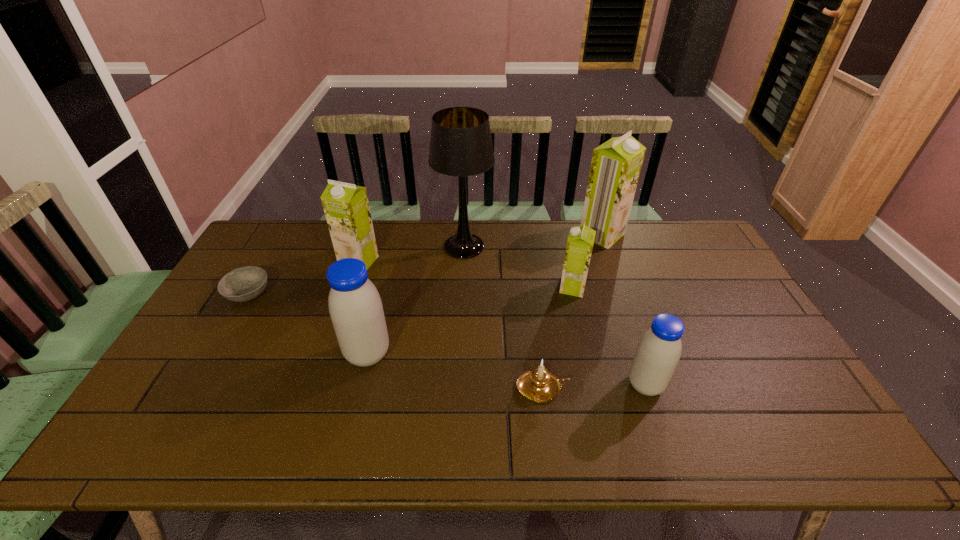
This screenshot has width=960, height=540. I want to click on free space between the leftmost object and the third object from right to left, so click(x=411, y=291).

The height and width of the screenshot is (540, 960). I want to click on free space between the bowl and the left blue soya milk, so pos(308,324).

Where is `vacant space in between the fifth object from left to right and the bigger blue soya milk`? This screenshot has height=540, width=960. vacant space in between the fifth object from left to right and the bigger blue soya milk is located at coordinates (455, 371).

You are a GUI agent. You are given a task and a screenshot of the screen. Output one action in this format:
    pyautogui.click(x=<x>, y=<y>)
    Task: Click on the free area in between the fourth object from right to left and the bigger blue soya milk
    The height and width of the screenshot is (540, 960).
    Given the screenshot: What is the action you would take?
    pyautogui.click(x=455, y=371)

Find the location of a particular element. The width and height of the screenshot is (960, 540). free area in between the tallest object and the second farthest soya milk is located at coordinates (412, 254).

The height and width of the screenshot is (540, 960). I want to click on object that can be found as the sixth closest to the fifth object from right to left, so click(x=243, y=284).

Choose which object is the fourth nearest neighbor to the second shortest object. Please provide its 2D coordinates. Your answer should be formatted as a tuple, i.e. [(x, y)], where the tuple contains the x and y coordinates of a point satisfying the conditions above.

[(461, 145)]

At what (x,y) coordinates should I click in order to perform the action: click on the fourth closest soya milk to the fifth object from left to right. Please return your answer as a coordinate pair (x, y). Image resolution: width=960 pixels, height=540 pixels. Looking at the image, I should click on (616, 164).

The height and width of the screenshot is (540, 960). I want to click on the closest soya milk to the smallest green soya milk, so pyautogui.click(x=616, y=164).

Where is `green soya milk that is the second closest to the leftmost green soya milk`? green soya milk that is the second closest to the leftmost green soya milk is located at coordinates (616, 164).